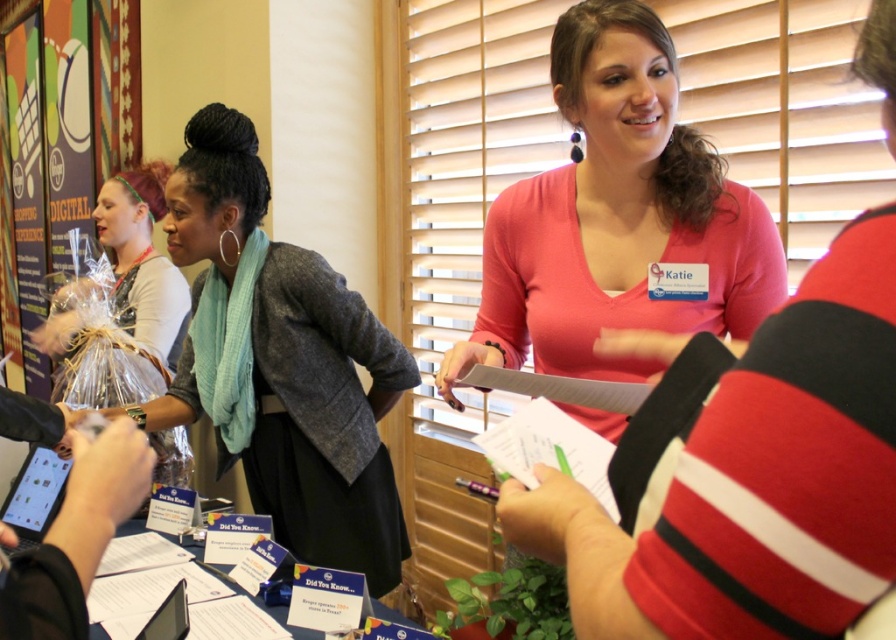
Where is the pink matte shirt at center located in the image?

The pink matte shirt at center is located at point (x=618, y=220) in the image.

You are standing at the entrance of the room and want to hand a document to the person wearing the gray woolen jacket at center. Which direction should you move to reach them?

The gray woolen jacket at center is located at point (281, 364), so you should move towards the center of the room to reach them.